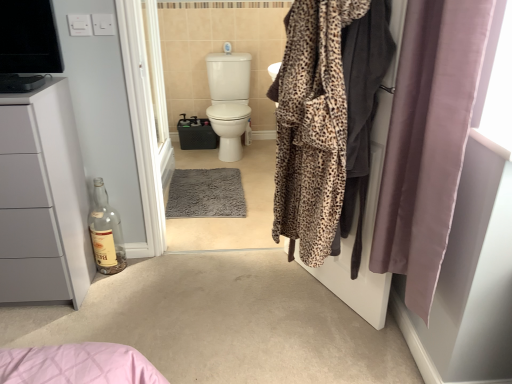
Question: Could you tell me if clear glass bottle at lower left is turned towards leopard print robe at right?

Choices:
 (A) yes
 (B) no

Answer: (B)

Question: Can you confirm if clear glass bottle at lower left is positioned to the left of leopard print robe at right?

Choices:
 (A) yes
 (B) no

Answer: (A)

Question: From the image's perspective, is clear glass bottle at lower left beneath leopard print robe at right?

Choices:
 (A) no
 (B) yes

Answer: (B)

Question: Considering the relative positions of clear glass bottle at lower left and leopard print robe at right in the image provided, is clear glass bottle at lower left to the right of leopard print robe at right from the viewer's perspective?

Choices:
 (A) no
 (B) yes

Answer: (A)

Question: Can you confirm if clear glass bottle at lower left is smaller than leopard print robe at right?

Choices:
 (A) yes
 (B) no

Answer: (A)

Question: Is white glossy screen door at center, acting as the second screen door starting from the front, taller or shorter than leopard print robe at right?

Choices:
 (A) short
 (B) tall

Answer: (B)

Question: Is white glossy screen door at center, marked as the 2th screen door in a right-to-left arrangement, bigger or smaller than leopard print robe at right?

Choices:
 (A) small
 (B) big

Answer: (B)

Question: Is white glossy screen door at center, marked as the 2th screen door in a right-to-left arrangement, to the left or to the right of leopard print robe at right in the image?

Choices:
 (A) right
 (B) left

Answer: (B)

Question: From the image's perspective, is white glossy screen door at center, acting as the second screen door starting from the front, located above or below leopard print robe at right?

Choices:
 (A) above
 (B) below

Answer: (A)

Question: From a real-world perspective, is silky mauve curtain at right physically located above or below clear glass bottle at lower left?

Choices:
 (A) above
 (B) below

Answer: (A)

Question: Considering the positions of silky mauve curtain at right and clear glass bottle at lower left in the image, is silky mauve curtain at right bigger or smaller than clear glass bottle at lower left?

Choices:
 (A) small
 (B) big

Answer: (B)

Question: In the image, is silky mauve curtain at right positioned in front of or behind clear glass bottle at lower left?

Choices:
 (A) front
 (B) behind

Answer: (A)

Question: Which is correct: silky mauve curtain at right is inside clear glass bottle at lower left, or outside of it?

Choices:
 (A) outside
 (B) inside

Answer: (A)

Question: From the image's perspective, is white glossy toilet at center located above or below clear glass bottle at lower left?

Choices:
 (A) below
 (B) above

Answer: (B)

Question: In terms of height, does white glossy toilet at center look taller or shorter compared to clear glass bottle at lower left?

Choices:
 (A) short
 (B) tall

Answer: (B)